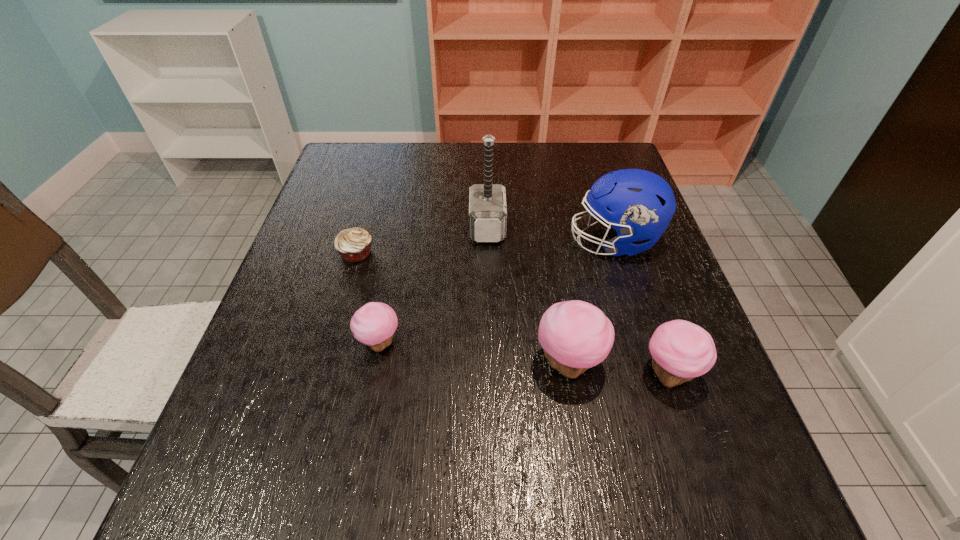
Identify the location of football helmet. (639, 204).

Locate an element on the screen. Image resolution: width=960 pixels, height=540 pixels. vacant point located 0.160m on the left of the shortest cupcake is located at coordinates (278, 343).

What are the coordinates of `vacant area located 0.210m on the back of the second cupcake from right to left` in the screenshot? It's located at (552, 264).

At what (x,y) coordinates should I click in order to perform the action: click on free region located on the left of the second shortest cupcake. Please return your answer as a coordinate pair (x, y). Looking at the image, I should click on (561, 374).

At what (x,y) coordinates should I click in order to perform the action: click on vacant space located on the right of the shortest object. Please return your answer as a coordinate pair (x, y). The image size is (960, 540). Looking at the image, I should click on (506, 253).

This screenshot has height=540, width=960. In order to click on free spot located 0.340m for striking with the head of the fourth object from right to left in this screenshot , I will do `click(339, 227)`.

Image resolution: width=960 pixels, height=540 pixels. I want to click on vacant space positioned 0.290m for striking with the head of the fourth object from right to left, so click(x=358, y=227).

You are a GUI agent. You are given a task and a screenshot of the screen. Output one action in this format:
    pyautogui.click(x=<x>, y=<y>)
    Task: Click on the free space located for striking with the head of the fourth object from right to left
    Image resolution: width=960 pixels, height=540 pixels.
    Given the screenshot: What is the action you would take?
    point(366,227)

This screenshot has width=960, height=540. Find the location of `blank space located 0.380m on the front-facing side of the fifth shortest object`. blank space located 0.380m on the front-facing side of the fifth shortest object is located at coordinates (418, 241).

Locate an element on the screen. vacant space located on the front-facing side of the fifth shortest object is located at coordinates (492, 241).